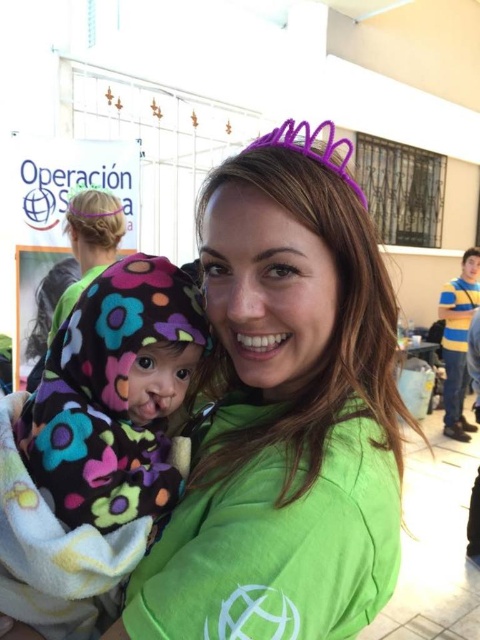
You are a photographer standing at a certain distance from the woman wearing the green matte shirt at center. You want to take a closeup shot of her shirt. Do you think you can move closer to get a better shot without exceeding the minimum focusing distance of your camera, which is 20 inches?

The distance between the green matte shirt at center and the camera is 19.86 inches, which is less than the camera minimum focusing distance of 20 inches. Therefore, you cannot move closer as you are already within the minimum focusing distance.

You are standing at the position of point [122,465] and want to move forward to the baby in the image. Is the point [282,314] blocking your path?

Point [282,314] is in front of point [122,465], so yes, it is blocking your path to the baby.

You are a photographer at the event and need to ensure that the green matte shirt at center and the fluffy fleece blanket at center are both clearly visible in the photo. Given that the camera can only focus on objects within a 5 inch range, will both items be in focus?

The green matte shirt at center is 5.29 inches away from the fluffy fleece blanket at center. Since the distance between them exceeds the camera focus range of 5 inches, they cannot both be in focus simultaneously.